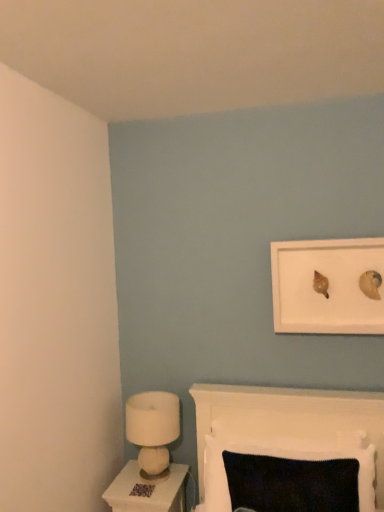
Question: From a real-world perspective, is white matte picture frame at upper right physically below knitted fabric cushion at lower center?

Choices:
 (A) no
 (B) yes

Answer: (A)

Question: Does white matte picture frame at upper right have a larger size compared to knitted fabric cushion at lower center?

Choices:
 (A) no
 (B) yes

Answer: (A)

Question: Is white matte picture frame at upper right further to the viewer compared to knitted fabric cushion at lower center?

Choices:
 (A) no
 (B) yes

Answer: (B)

Question: Is white matte picture frame at upper right in contact with knitted fabric cushion at lower center?

Choices:
 (A) yes
 (B) no

Answer: (B)

Question: Would you say white matte picture frame at upper right is a long distance from knitted fabric cushion at lower center?

Choices:
 (A) yes
 (B) no

Answer: (B)

Question: Looking at the image, does white felt lamp at lower left seem bigger or smaller compared to brown textured carpet at lower center?

Choices:
 (A) big
 (B) small

Answer: (A)

Question: From the image's perspective, is white felt lamp at lower left above or below brown textured carpet at lower center?

Choices:
 (A) below
 (B) above

Answer: (B)

Question: Is white felt lamp at lower left inside or outside of brown textured carpet at lower center?

Choices:
 (A) outside
 (B) inside

Answer: (A)

Question: Considering the positions of point (127, 419) and point (145, 484), is point (127, 419) closer or farther from the camera than point (145, 484)?

Choices:
 (A) farther
 (B) closer

Answer: (A)

Question: Choose the correct answer: Is white matte picture frame at upper right inside knitted fabric cushion at lower center or outside it?

Choices:
 (A) inside
 (B) outside

Answer: (B)

Question: In terms of size, does white matte picture frame at upper right appear bigger or smaller than knitted fabric cushion at lower center?

Choices:
 (A) small
 (B) big

Answer: (A)

Question: Considering their positions, is white matte picture frame at upper right located in front of or behind knitted fabric cushion at lower center?

Choices:
 (A) front
 (B) behind

Answer: (B)

Question: Does point (364, 244) appear closer or farther from the camera than point (200, 477)?

Choices:
 (A) farther
 (B) closer

Answer: (B)

Question: Relative to knitted fabric cushion at lower center, is brown textured carpet at lower center in front or behind?

Choices:
 (A) behind
 (B) front

Answer: (A)

Question: Is brown textured carpet at lower center wider or thinner than knitted fabric cushion at lower center?

Choices:
 (A) thin
 (B) wide

Answer: (A)